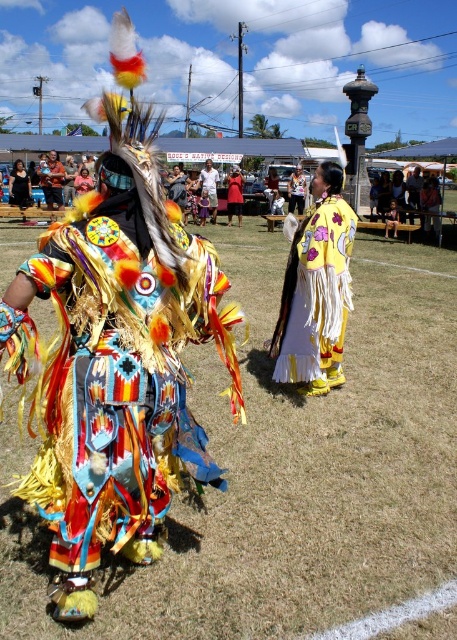
You are an artist trying to sketch the scene. You want to place the yellow satin cape at center in your drawing. Where should you position it on a grid from 0 to 1 in both x and y coordinates?

The yellow satin cape at center should be positioned at coordinates approximately 0.469 in the x direction and 0.691 in the y direction.